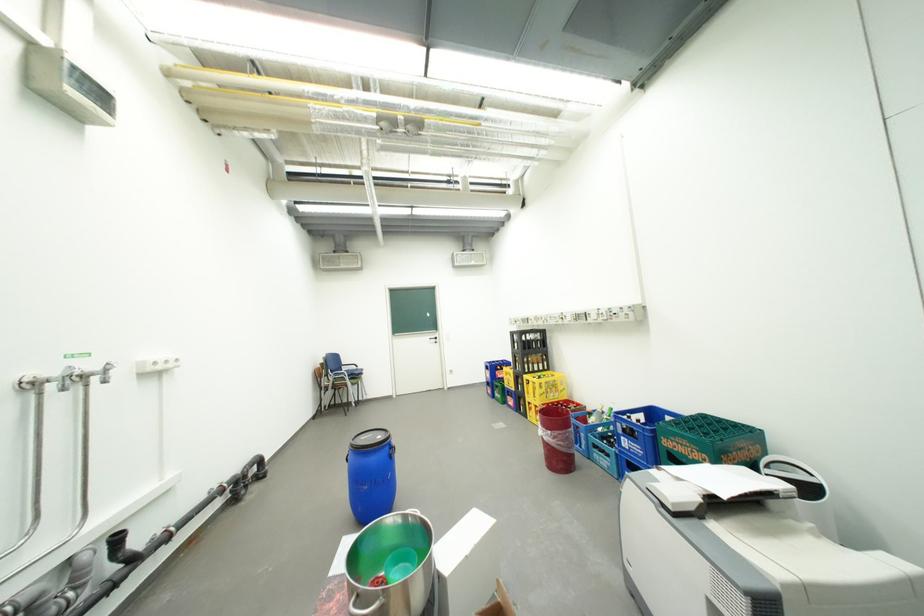
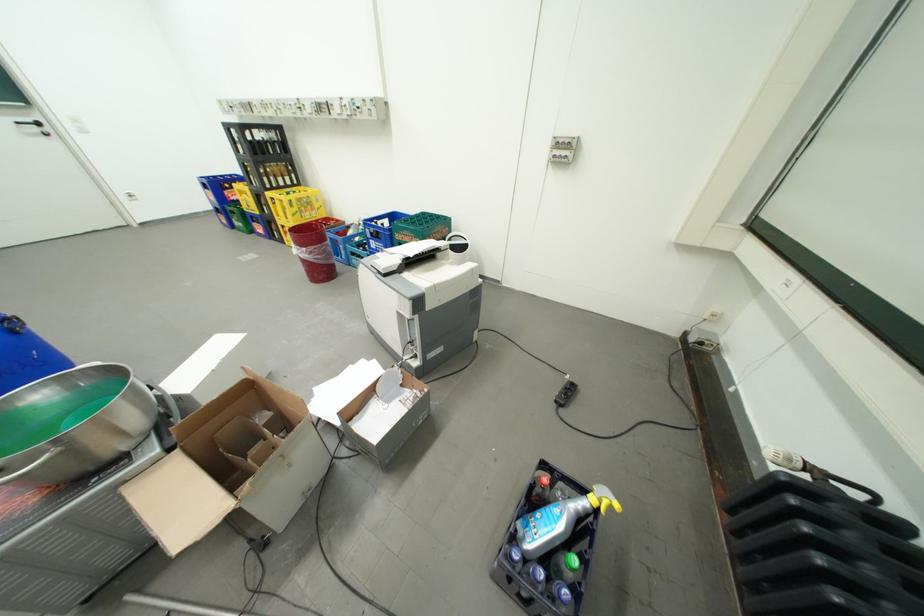
Find the pixel in the second image that matches point (457, 373) in the first image.

(134, 199)